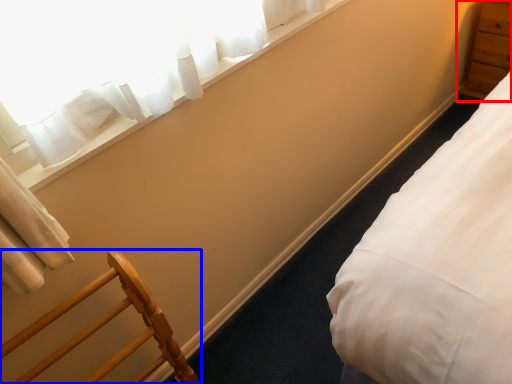
Question: Which point is closer to the camera, dresser (highlighted by a red box) or furniture (highlighted by a blue box)?

Choices:
 (A) dresser
 (B) furniture

Answer: (B)